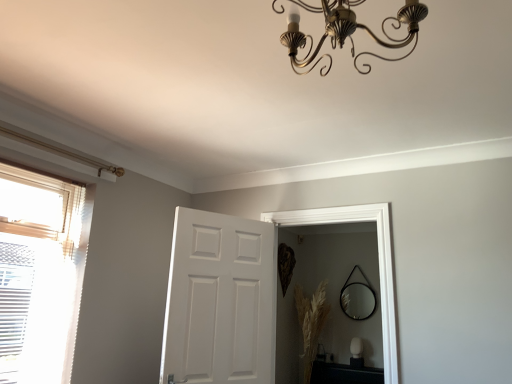
Question: From the image's perspective, is gold metallic chandelier at upper center located above black glass mirror at center?

Choices:
 (A) no
 (B) yes

Answer: (B)

Question: Considering the relative sizes of gold metallic chandelier at upper center and black glass mirror at center in the image provided, is gold metallic chandelier at upper center taller than black glass mirror at center?

Choices:
 (A) yes
 (B) no

Answer: (B)

Question: Does gold metallic chandelier at upper center contain black glass mirror at center?

Choices:
 (A) no
 (B) yes

Answer: (A)

Question: Is gold metallic chandelier at upper center thinner than black glass mirror at center?

Choices:
 (A) yes
 (B) no

Answer: (B)

Question: Would you consider gold metallic chandelier at upper center to be distant from black glass mirror at center?

Choices:
 (A) no
 (B) yes

Answer: (B)

Question: From a real-world perspective, does gold metallic chandelier at upper center sit lower than black glass mirror at center?

Choices:
 (A) no
 (B) yes

Answer: (A)

Question: Can you confirm if black glossy table at lower right is shorter than translucent fabric window at left?

Choices:
 (A) no
 (B) yes

Answer: (B)

Question: Can you confirm if black glossy table at lower right is thinner than translucent fabric window at left?

Choices:
 (A) no
 (B) yes

Answer: (A)

Question: Is the depth of black glossy table at lower right less than that of translucent fabric window at left?

Choices:
 (A) no
 (B) yes

Answer: (A)

Question: Is black glossy table at lower right wider than translucent fabric window at left?

Choices:
 (A) no
 (B) yes

Answer: (B)

Question: Is black glossy table at lower right touching translucent fabric window at left?

Choices:
 (A) yes
 (B) no

Answer: (B)

Question: Does black glossy table at lower right appear on the left side of translucent fabric window at left?

Choices:
 (A) yes
 (B) no

Answer: (B)

Question: Considering the relative positions of white matte door at center and black glossy table at lower right in the image provided, is white matte door at center behind black glossy table at lower right?

Choices:
 (A) yes
 (B) no

Answer: (B)